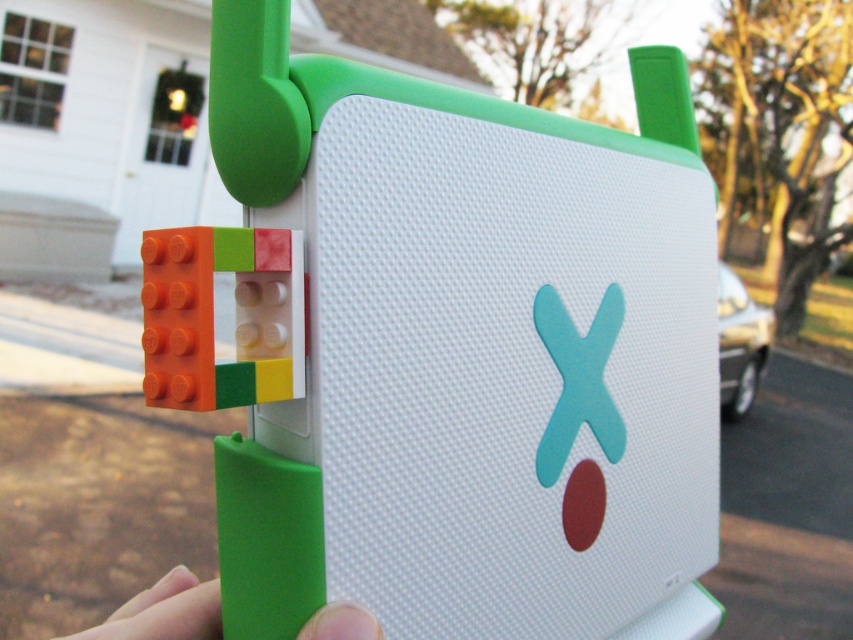
You are a child trying to stack the matte plastic building blocks at left and the green rubber grip at lower center. Which object should you place at the bottom to make the tower more stable?

The matte plastic building blocks at left should be placed at the bottom because it is much taller than the green rubber grip at lower center, providing a wider base for stability.

You are holding the device and want to touch the point at coordinates (352,486). Can you reach it without moving your hand?

The point at coordinates (352,486) is 16.23 inches away from the viewer, so you cannot reach it without moving your hand since it is too far.